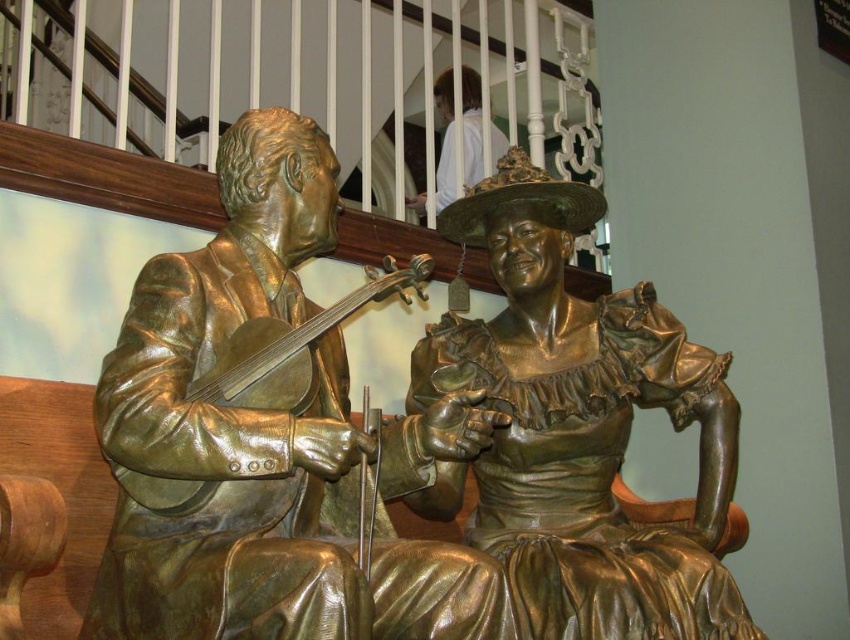
Question: Which point is farther to the camera?

Choices:
 (A) (491, 163)
 (B) (409, 573)
 (C) (434, 336)

Answer: (A)

Question: Does bronze statue at center come in front of white fabric at upper center?

Choices:
 (A) no
 (B) yes

Answer: (B)

Question: Which is nearer to the bronze violinist at center?

Choices:
 (A) bronze statue at center
 (B) white fabric at upper center

Answer: (A)

Question: Is bronze statue at center bigger than white fabric at upper center?

Choices:
 (A) no
 (B) yes

Answer: (A)

Question: Estimate the real-world distances between objects in this image. Which object is farther from the bronze statue at center?

Choices:
 (A) bronze violinist at center
 (B) white fabric at upper center

Answer: (B)

Question: Is bronze statue at center thinner than white fabric at upper center?

Choices:
 (A) yes
 (B) no

Answer: (A)